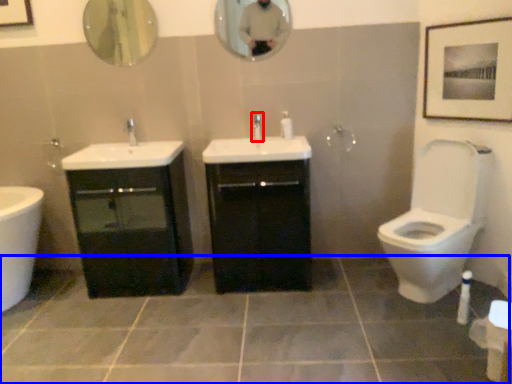
Question: Which object is closer to the camera taking this photo, tap (highlighted by a red box) or ceramic tile (highlighted by a blue box)?

Choices:
 (A) tap
 (B) ceramic tile

Answer: (B)